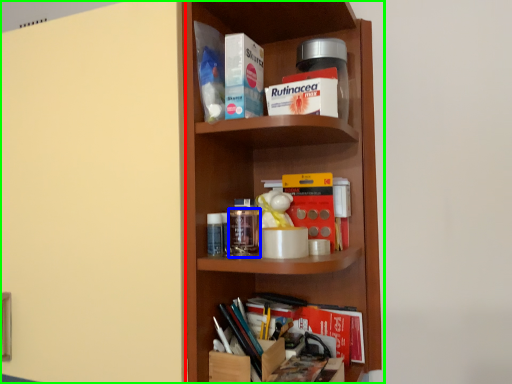
Question: Which object is the farthest from door (highlighted by a red box)? Choose among these: glass jar (highlighted by a blue box) or shelf (highlighted by a green box).

Choices:
 (A) glass jar
 (B) shelf

Answer: (A)